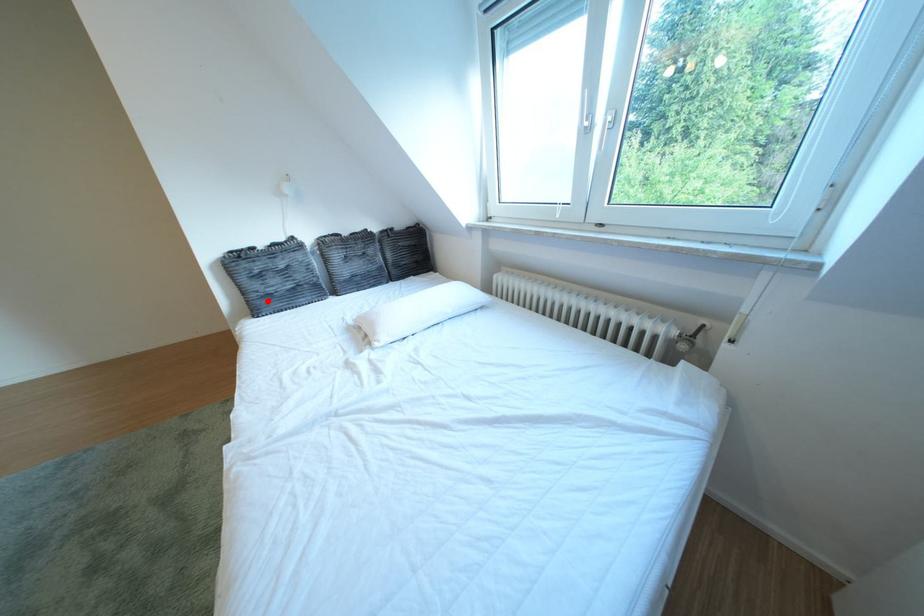
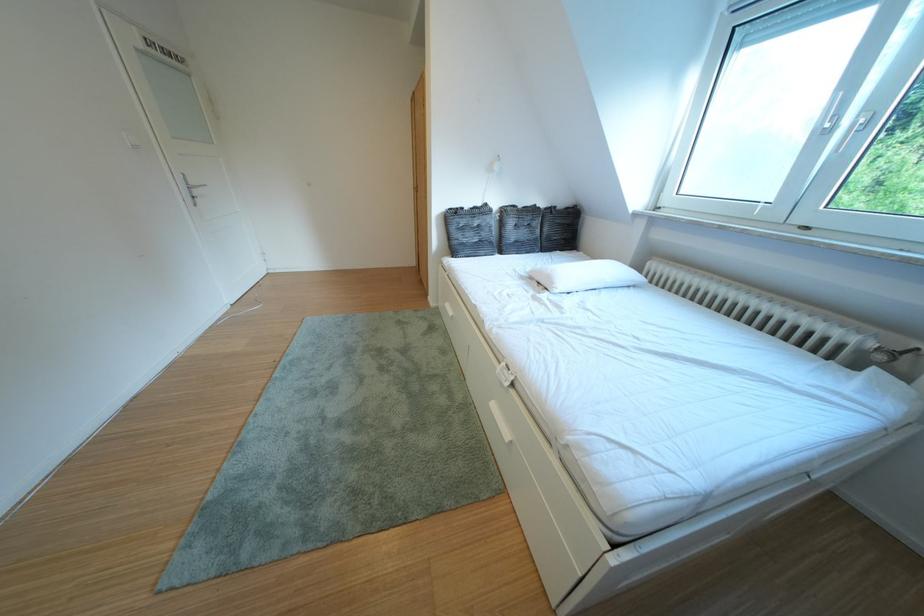
Find the pixel in the second image that matches the highlighted location in the first image.

(468, 246)